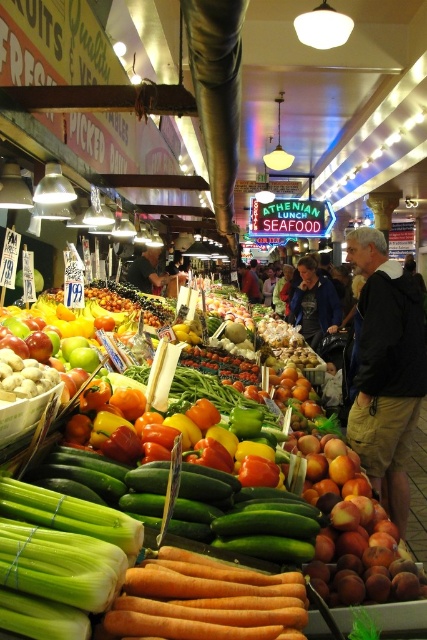
Is point (137, 275) closer to camera compared to point (254, 284)?

Yes, point (137, 275) is closer to viewer.

Can you confirm if dark blue shirt at center is taller than dark blue jacket at center?

No, dark blue shirt at center is not taller than dark blue jacket at center.

You are a GUI agent. You are given a task and a screenshot of the screen. Output one action in this format:
    pyautogui.click(x=<x>, y=<y>)
    Task: Click on the dark blue shirt at center
    This screenshot has height=640, width=427.
    Given the screenshot: What is the action you would take?
    pyautogui.click(x=149, y=272)

Find the location of a particular element. This screenshot has height=640, width=427. dark blue shirt at center is located at coordinates (149, 272).

Which is below, black cotton jacket at center or dark blue jacket at center?

black cotton jacket at center is below.

Does black cotton jacket at center have a larger size compared to dark blue jacket at center?

Incorrect, black cotton jacket at center is not larger than dark blue jacket at center.

Who is more forward, (391,269) or (257,289)?

Point (391,269) is in front.

The image size is (427, 640). I want to click on black cotton jacket at center, so click(x=386, y=371).

Is orange smooth carrot at lower center thinner than dark blue shirt at center?

Correct, orange smooth carrot at lower center's width is less than dark blue shirt at center's.

The width and height of the screenshot is (427, 640). I want to click on orange smooth carrot at lower center, so click(207, 600).

This screenshot has width=427, height=640. What are the coordinates of `orange smooth carrot at lower center` in the screenshot? It's located at (207, 600).

Identify the location of orange smooth carrot at lower center. The height and width of the screenshot is (640, 427). (207, 600).